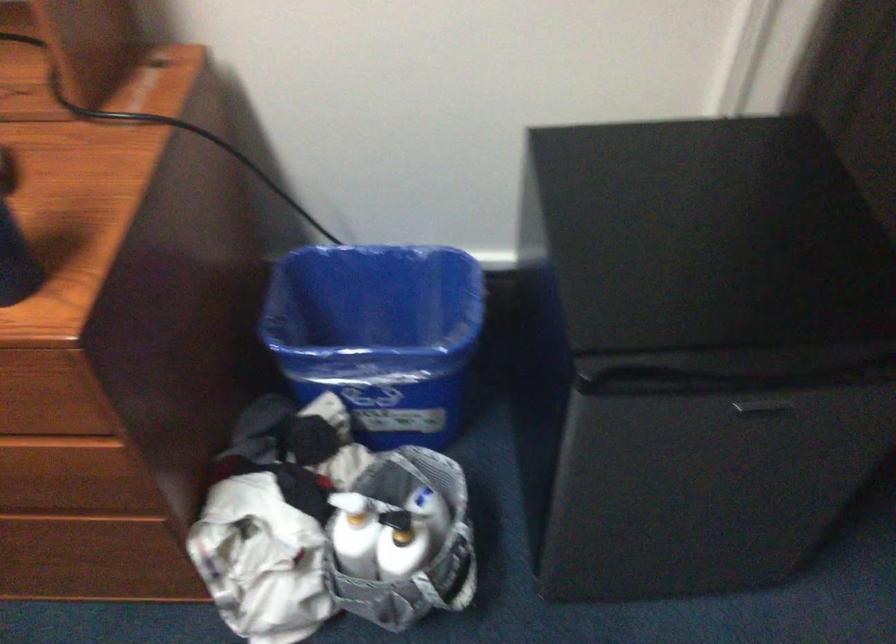
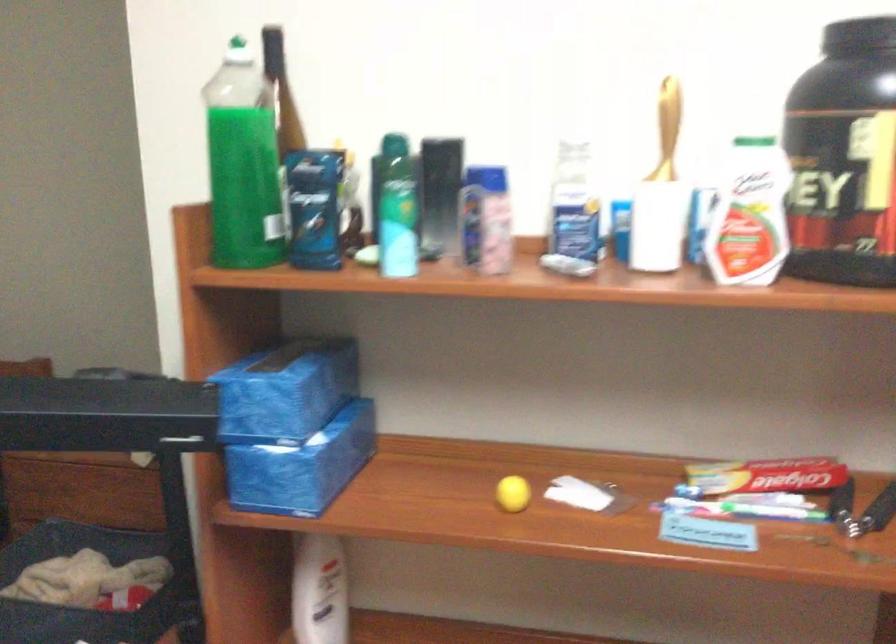
Question: Based on the continuous images, in which direction is the camera rotating? Reply with the corresponding letter.

Choices:
 (A) Left
 (B) Right
 (C) Up
 (D) Down

Answer: (C)